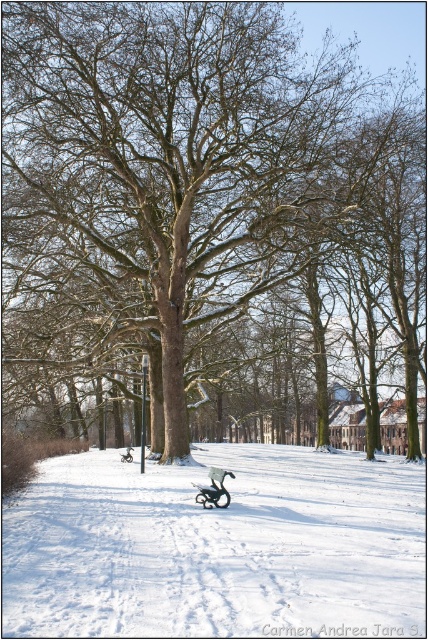
Question: Does white fluffy snow at center have a larger size compared to metallic silver sleigh at center?

Choices:
 (A) no
 (B) yes

Answer: (B)

Question: Which point is farther from the camera taking this photo?

Choices:
 (A) (214, 474)
 (B) (389, 499)

Answer: (B)

Question: Which of the following is the closest to the observer?

Choices:
 (A) metallic silver sleigh at center
 (B) white fluffy snow at center
 (C) brown rough tree at center

Answer: (B)

Question: Observing the image, what is the correct spatial positioning of brown rough tree at center in reference to white fluffy snow at center?

Choices:
 (A) below
 (B) above

Answer: (B)

Question: Which point is closer to the camera?

Choices:
 (A) (232, 474)
 (B) (21, 241)

Answer: (A)

Question: Is brown rough tree at center thinner than white fluffy snow at center?

Choices:
 (A) no
 (B) yes

Answer: (A)